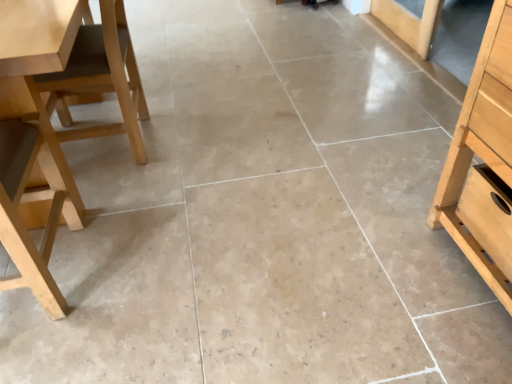
Question: Are light wood drawer at right and light brown wood chair at left, the 2th chair in the front-to-back sequence, beside each other?

Choices:
 (A) yes
 (B) no

Answer: (B)

Question: From a real-world perspective, is light wood drawer at right beneath light brown wood chair at left, the 2th chair in the front-to-back sequence?

Choices:
 (A) no
 (B) yes

Answer: (B)

Question: Is light wood drawer at right further to camera compared to light brown wood chair at left, the 2th chair in the front-to-back sequence?

Choices:
 (A) no
 (B) yes

Answer: (A)

Question: Does light wood drawer at right have a greater width compared to light brown wood chair at left, the 2th chair in the front-to-back sequence?

Choices:
 (A) yes
 (B) no

Answer: (B)

Question: Can you confirm if light wood drawer at right is positioned to the left of light brown wood chair at left, the 2th chair in the front-to-back sequence?

Choices:
 (A) yes
 (B) no

Answer: (B)

Question: Would you consider light wood drawer at right to be distant from light brown wood chair at left, acting as the first chair starting from the back?

Choices:
 (A) yes
 (B) no

Answer: (A)

Question: Considering the relative sizes of light brown wood chair at left, the 2th chair in the front-to-back sequence, and light wood drawer at right in the image provided, is light brown wood chair at left, the 2th chair in the front-to-back sequence, bigger than light wood drawer at right?

Choices:
 (A) no
 (B) yes

Answer: (B)

Question: Considering the relative sizes of light brown wood chair at left, acting as the first chair starting from the back, and light wood drawer at right in the image provided, is light brown wood chair at left, acting as the first chair starting from the back, smaller than light wood drawer at right?

Choices:
 (A) yes
 (B) no

Answer: (B)

Question: Considering the relative sizes of light brown wood chair at left, acting as the first chair starting from the back, and light wood drawer at right in the image provided, is light brown wood chair at left, acting as the first chair starting from the back, taller than light wood drawer at right?

Choices:
 (A) no
 (B) yes

Answer: (B)

Question: From a real-world perspective, does light brown wood chair at left, the 2th chair in the front-to-back sequence, stand above light wood drawer at right?

Choices:
 (A) yes
 (B) no

Answer: (A)

Question: Is light brown wood chair at left, acting as the first chair starting from the back, at the left side of light wood drawer at right?

Choices:
 (A) yes
 (B) no

Answer: (A)

Question: From the image's perspective, does light brown wood chair at left, acting as the first chair starting from the back, appear lower than light wood drawer at right?

Choices:
 (A) yes
 (B) no

Answer: (B)

Question: Considering the relative positions of light brown wood chair at left, the 2th chair in the front-to-back sequence, and light wood chair at left, the first chair when ordered from front to back, in the image provided, is light brown wood chair at left, the 2th chair in the front-to-back sequence, to the right of light wood chair at left, the first chair when ordered from front to back, from the viewer's perspective?

Choices:
 (A) no
 (B) yes

Answer: (B)